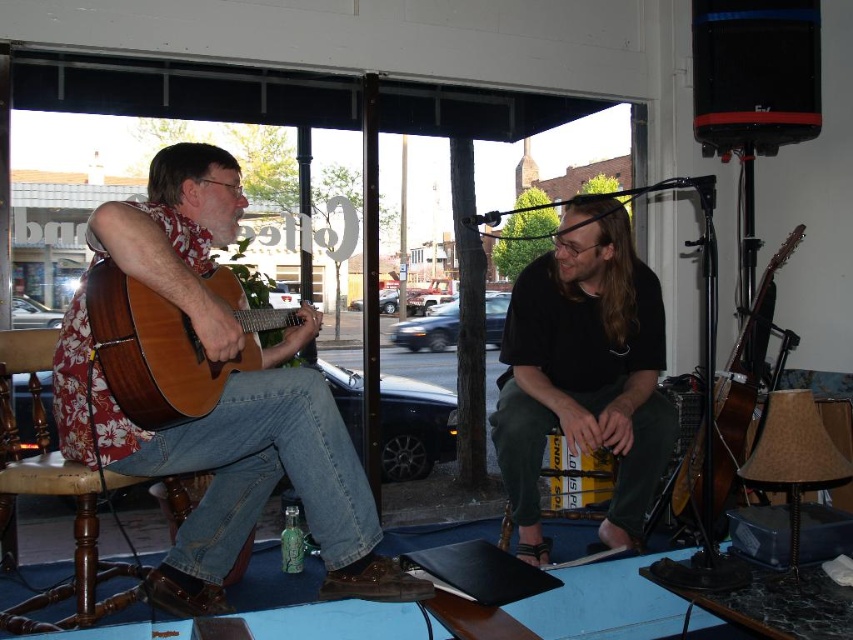
Question: Which point is closer to the camera?

Choices:
 (A) brown wooden stool at lower left
 (B) wooden acoustic guitar at left
 (C) brown acoustic guitar at right
 (D) natural wood acoustic guitar at left

Answer: (B)

Question: Does natural wood acoustic guitar at left appear over brown wooden stool at lower left?

Choices:
 (A) no
 (B) yes

Answer: (B)

Question: Based on their relative distances, which object is farther from the wooden acoustic guitar at left?

Choices:
 (A) black matte shirt at center
 (B) brown acoustic guitar at right

Answer: (B)

Question: Which object is the farthest from the natural wood acoustic guitar at left?

Choices:
 (A) black matte shirt at center
 (B) brown acoustic guitar at right
 (C) brown wooden stool at lower left

Answer: (B)

Question: Is wooden acoustic guitar at left bigger than black matte shirt at center?

Choices:
 (A) yes
 (B) no

Answer: (A)

Question: In this image, where is wooden acoustic guitar at left located relative to natural wood acoustic guitar at left?

Choices:
 (A) left
 (B) right

Answer: (B)